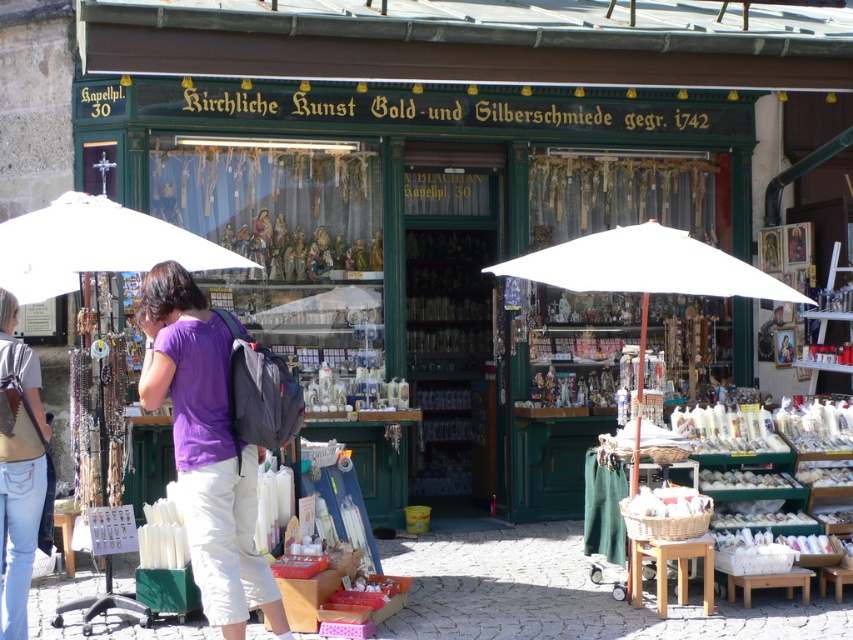
Question: Considering the real-world distances, which object is farthest from the white fabric umbrella at center?

Choices:
 (A) denim jeans at lower left
 (B) purple fabric shirt at center

Answer: (A)

Question: Considering the relative positions of purple fabric shirt at center and white fabric umbrella at center in the image provided, where is purple fabric shirt at center located with respect to white fabric umbrella at center?

Choices:
 (A) left
 (B) right

Answer: (A)

Question: Is purple fabric shirt at center above white fabric umbrella at center?

Choices:
 (A) yes
 (B) no

Answer: (B)

Question: Is purple fabric shirt at center above denim jeans at lower left?

Choices:
 (A) no
 (B) yes

Answer: (B)

Question: Which object is farther from the camera taking this photo?

Choices:
 (A) denim jeans at lower left
 (B) white fabric umbrella at center

Answer: (B)

Question: Which is nearer to the denim jeans at lower left?

Choices:
 (A) purple fabric shirt at center
 (B) white fabric umbrella at center

Answer: (A)